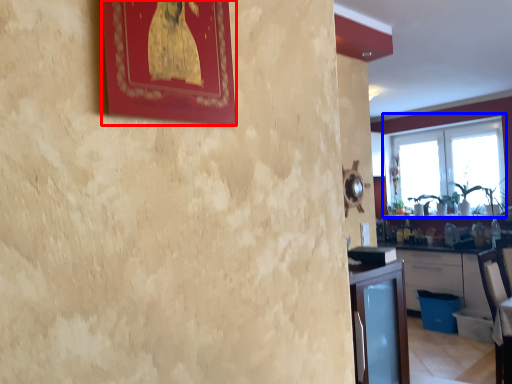
Question: Which object is closer to the camera taking this photo, picture frame (highlighted by a red box) or window (highlighted by a blue box)?

Choices:
 (A) picture frame
 (B) window

Answer: (A)